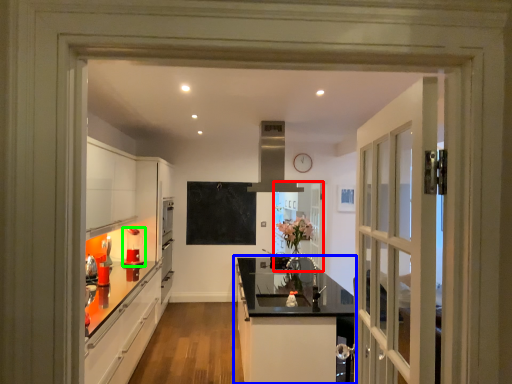
Question: Which object is positioned farthest from door (highlighted by a red box)? Select from cabinetry (highlighted by a blue box) and appliance (highlighted by a green box).

Choices:
 (A) cabinetry
 (B) appliance

Answer: (B)